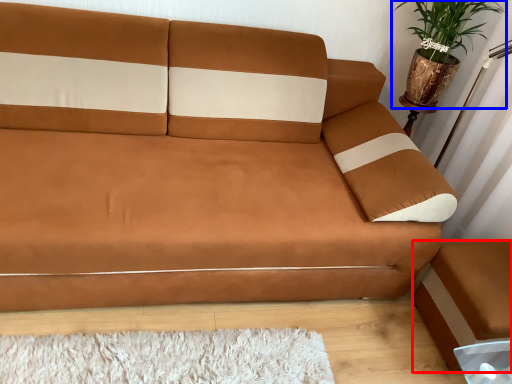
Question: Among these objects, which one is farthest to the camera, footrest (highlighted by a red box) or houseplant (highlighted by a blue box)?

Choices:
 (A) footrest
 (B) houseplant

Answer: (B)